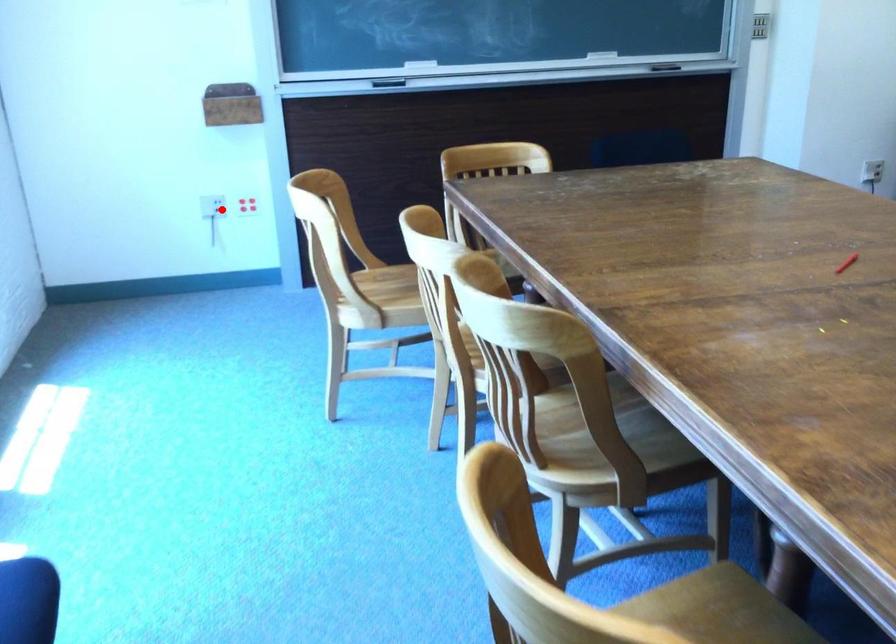
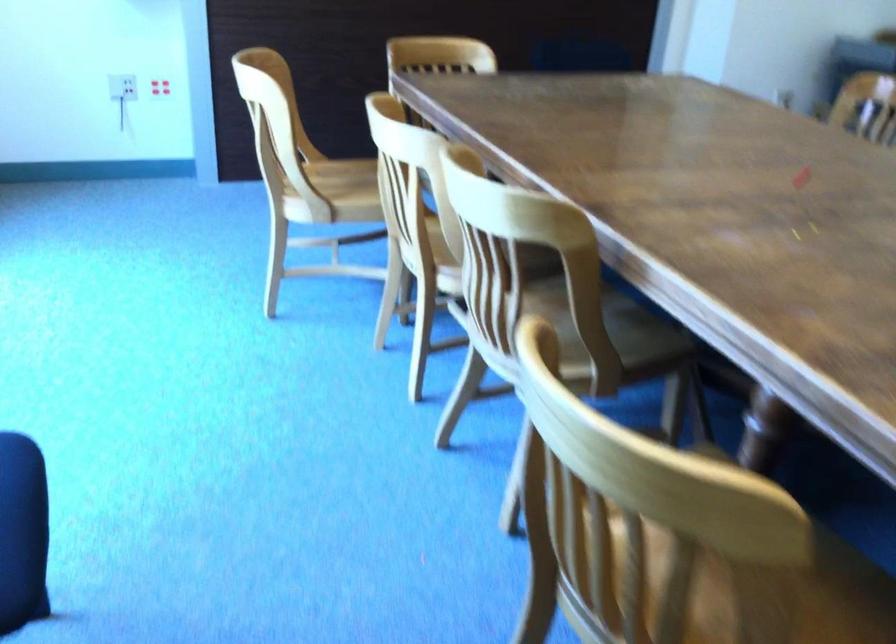
Question: I am providing you with two images of the same scene from different viewpoints. Image1 has a red point marked. In image2, the corresponding 3D location appears at what relative position? Reply with the corresponding letter.

Choices:
 (A) Closer
 (B) Farther

Answer: (A)